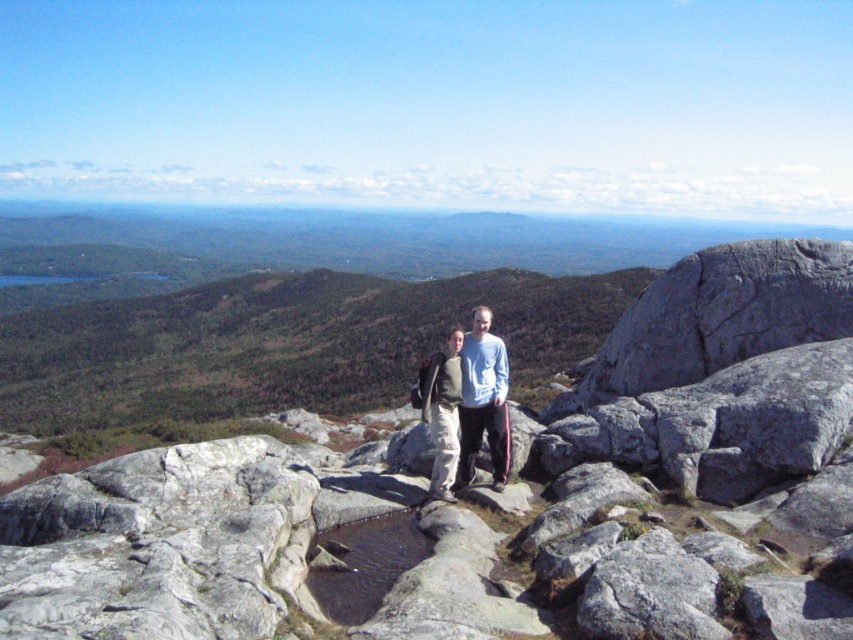
Question: Is matte gray pants at center further to camera compared to gray fabric jacket at center?

Choices:
 (A) no
 (B) yes

Answer: (A)

Question: Which point appears closest to the camera in this image?

Choices:
 (A) (480, 404)
 (B) (494, 480)
 (C) (439, 380)

Answer: (C)

Question: Among these points, which one is farthest from the camera?

Choices:
 (A) (444, 497)
 (B) (437, 456)
 (C) (506, 387)

Answer: (C)

Question: Which of the following is the closest to the observer?

Choices:
 (A) light blue cotton shirt at center
 (B) gray fabric jacket at center

Answer: (A)

Question: Is light blue cotton shirt at center to the right of gray fabric jacket at center from the viewer's perspective?

Choices:
 (A) no
 (B) yes

Answer: (B)

Question: Is the position of matte gray pants at center more distant than that of light blue cotton shirt at center?

Choices:
 (A) yes
 (B) no

Answer: (B)